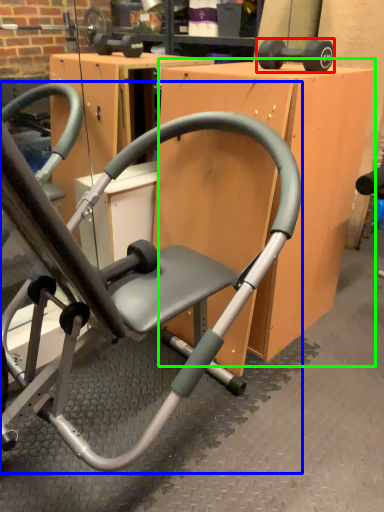
Question: Which object is positioned closest to dumbbell (highlighted by a red box)? Select from chair (highlighted by a blue box) and table (highlighted by a green box).

Choices:
 (A) chair
 (B) table

Answer: (B)